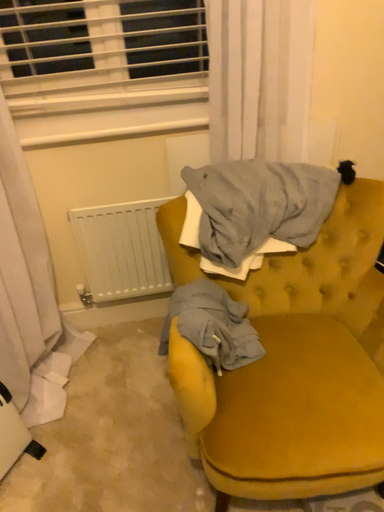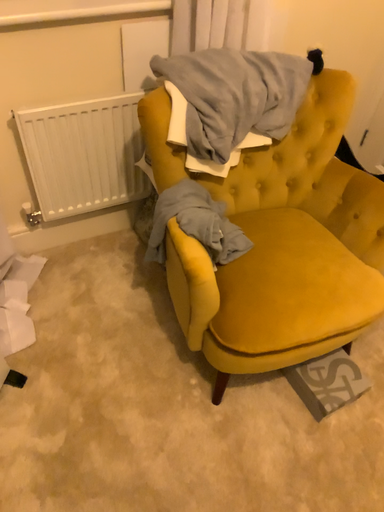
Question: How did the camera likely rotate when shooting the video?

Choices:
 (A) rotated downward
 (B) rotated upward

Answer: (A)